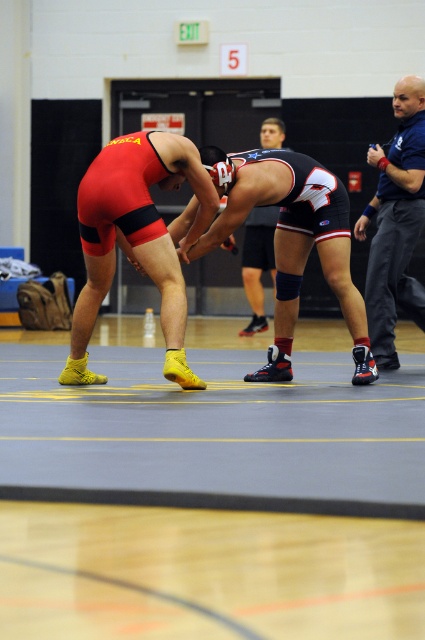
Is point (232, 221) farther from camera compared to point (402, 234)?

No, (232, 221) is closer to viewer.

Image resolution: width=425 pixels, height=640 pixels. I want to click on shiny black wrestling singlet at center, so click(291, 241).

Which is behind, point (334, 176) or point (382, 234)?

Positioned behind is point (382, 234).

This screenshot has width=425, height=640. In order to click on shiny black wrestling singlet at center in this screenshot , I will do `click(291, 241)`.

Can you confirm if matte red wrestling singlet at center is shorter than shiny black shorts at center?

No, matte red wrestling singlet at center is not shorter than shiny black shorts at center.

Who is more distant from viewer, (95, 266) or (246, 257)?

Positioned behind is point (246, 257).

Who is more forward, (170, 289) or (268, 212)?

Point (170, 289)

Where is `matte red wrestling singlet at center`? This screenshot has height=640, width=425. matte red wrestling singlet at center is located at coordinates (136, 237).

Between shiny black wrestling singlet at center and shiny black shorts at center, which one has more height?

With more height is shiny black wrestling singlet at center.

This screenshot has width=425, height=640. What do you see at coordinates (291, 241) in the screenshot? I see `shiny black wrestling singlet at center` at bounding box center [291, 241].

The height and width of the screenshot is (640, 425). Find the location of `shiny black wrestling singlet at center`. shiny black wrestling singlet at center is located at coordinates (291, 241).